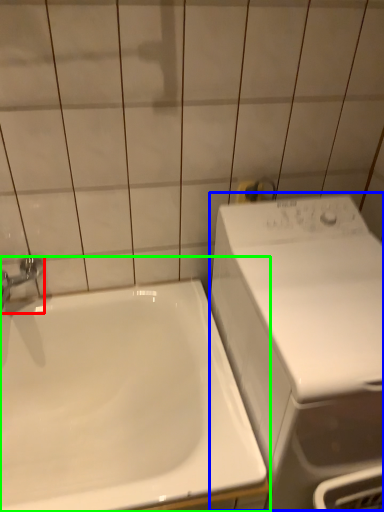
Question: Which is nearer to the tap (highlighted by a red box)? washing machine (highlighted by a blue box) or sink (highlighted by a green box).

Choices:
 (A) washing machine
 (B) sink

Answer: (B)